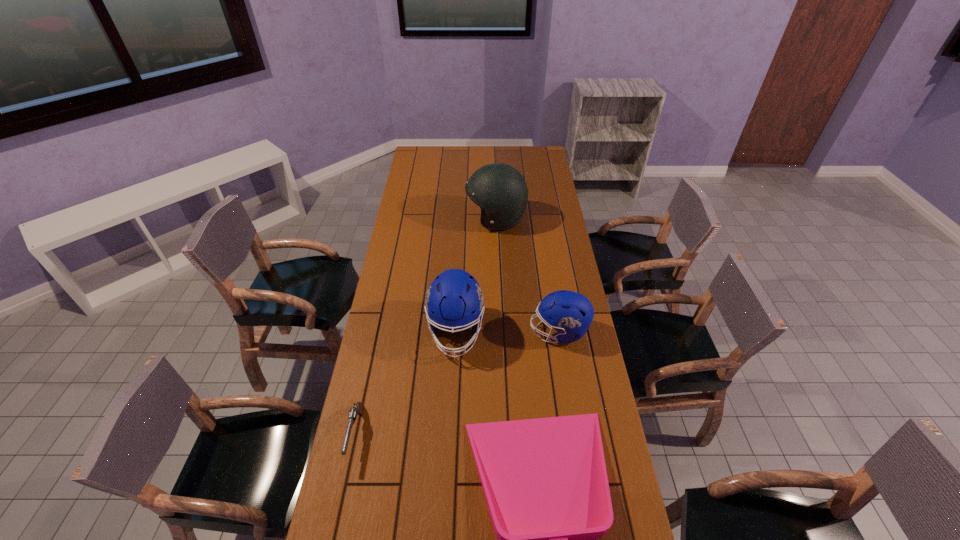
Find the location of a particular element. the farthest object is located at coordinates (500, 190).

At what (x,y) coordinates should I click in order to perform the action: click on the shortest football helmet. Please return your answer as a coordinate pair (x, y). This screenshot has height=540, width=960. Looking at the image, I should click on (570, 313).

Where is `the leftmost object`? The image size is (960, 540). the leftmost object is located at coordinates (358, 408).

I want to click on the second shortest object, so tap(358, 408).

Image resolution: width=960 pixels, height=540 pixels. I want to click on free location located at the face opening of the farthest object, so click(x=444, y=219).

Where is `free space located 0.150m at the face opening of the farthest object`? This screenshot has width=960, height=540. free space located 0.150m at the face opening of the farthest object is located at coordinates (434, 219).

Locate an element on the screen. vacant region located at the face opening of the farthest object is located at coordinates (400, 219).

Where is `free space located 0.110m on the front-facing side of the shortest football helmet`? The height and width of the screenshot is (540, 960). free space located 0.110m on the front-facing side of the shortest football helmet is located at coordinates (499, 332).

Find the location of a particular element. The width and height of the screenshot is (960, 540). vacant area situated 0.100m on the front-facing side of the shortest football helmet is located at coordinates (502, 332).

Identify the location of free space located 0.090m on the front-facing side of the shortest football helmet. (504, 332).